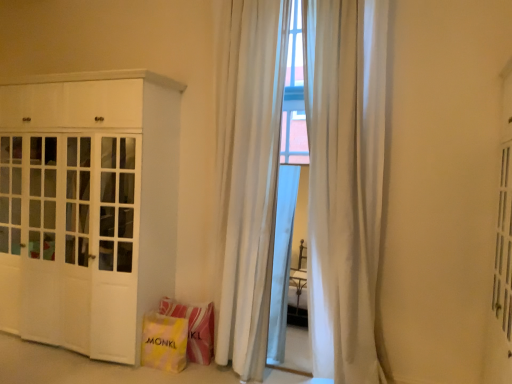
Question: Which direction should I rotate to look at white sheer curtain at center, the 2th curtain positioned from the left, — up or down?

Choices:
 (A) down
 (B) up

Answer: (B)

Question: Is white matte cabinet at left located outside white sheer curtain at center, which is the first curtain from left to right?

Choices:
 (A) yes
 (B) no

Answer: (A)

Question: Considering the relative sizes of white matte cabinet at left and white sheer curtain at center, which is the first curtain from left to right, in the image provided, is white matte cabinet at left bigger than white sheer curtain at center, which is the first curtain from left to right,?

Choices:
 (A) no
 (B) yes

Answer: (B)

Question: Does white matte cabinet at left have a greater height compared to white sheer curtain at center, which is the first curtain from left to right?

Choices:
 (A) yes
 (B) no

Answer: (B)

Question: Is white matte cabinet at left at the left side of white sheer curtain at center, placed as the second curtain when sorted from right to left?

Choices:
 (A) no
 (B) yes

Answer: (B)

Question: Is white matte cabinet at left surrounding white sheer curtain at center, placed as the second curtain when sorted from right to left?

Choices:
 (A) no
 (B) yes

Answer: (A)

Question: From the image's perspective, does white matte cabinet at left appear higher than white sheer curtain at center, placed as the second curtain when sorted from right to left?

Choices:
 (A) no
 (B) yes

Answer: (A)

Question: From a real-world perspective, is white sheer curtain at center, the 1th curtain viewed from the right, beneath yellow fabric shopping bag at lower left, placed as the 1th shopping bag when sorted from front to back?

Choices:
 (A) yes
 (B) no

Answer: (B)

Question: Can you confirm if white sheer curtain at center, the 2th curtain positioned from the left, is positioned to the left of yellow fabric shopping bag at lower left, placed as the 1th shopping bag when sorted from front to back?

Choices:
 (A) yes
 (B) no

Answer: (B)

Question: Is white sheer curtain at center, the 1th curtain viewed from the right, shorter than yellow fabric shopping bag at lower left, positioned as the 2th shopping bag in back-to-front order?

Choices:
 (A) no
 (B) yes

Answer: (A)

Question: Can you confirm if white sheer curtain at center, the 2th curtain positioned from the left, is wider than yellow fabric shopping bag at lower left, placed as the 1th shopping bag when sorted from front to back?

Choices:
 (A) yes
 (B) no

Answer: (B)

Question: Is the surface of white sheer curtain at center, the 2th curtain positioned from the left, in direct contact with yellow fabric shopping bag at lower left, placed as the 1th shopping bag when sorted from front to back?

Choices:
 (A) no
 (B) yes

Answer: (A)

Question: Is yellow fabric shopping bag at lower left, placed as the 1th shopping bag when sorted from front to back, inside white sheer curtain at center, the 1th curtain viewed from the right?

Choices:
 (A) yes
 (B) no

Answer: (B)

Question: Considering the relative sizes of yellow fabric shopping bag at lower left, positioned as the 2th shopping bag in back-to-front order, and yellow fabric shopping bag at lower center, which appears as the second shopping bag when viewed from the front, in the image provided, is yellow fabric shopping bag at lower left, positioned as the 2th shopping bag in back-to-front order, bigger than yellow fabric shopping bag at lower center, which appears as the second shopping bag when viewed from the front,?

Choices:
 (A) no
 (B) yes

Answer: (A)